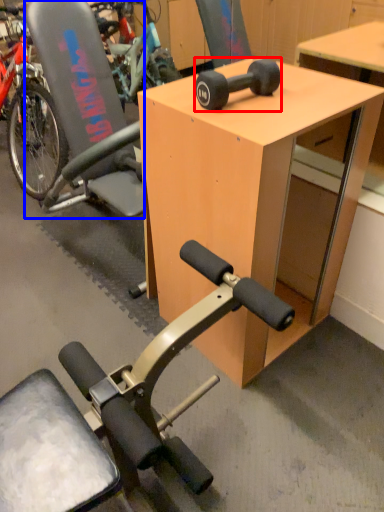
Question: Which point is further to the camera, wheel (highlighted by a red box) or swivel chair (highlighted by a blue box)?

Choices:
 (A) wheel
 (B) swivel chair

Answer: (B)